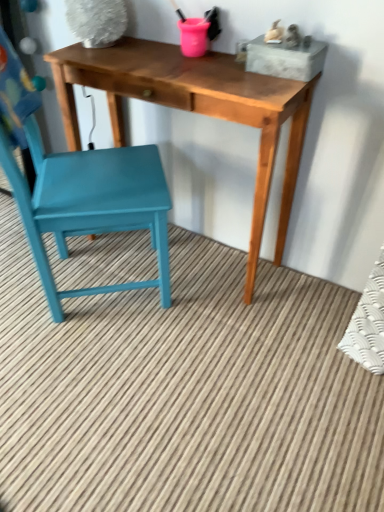
You are a GUI agent. You are given a task and a screenshot of the screen. Output one action in this format:
    pyautogui.click(x=<x>, y=<y>)
    Task: Click on the vacant area situated below wooden table at center (from a real-world perspective)
    The width and height of the screenshot is (384, 512).
    Given the screenshot: What is the action you would take?
    pyautogui.click(x=197, y=258)